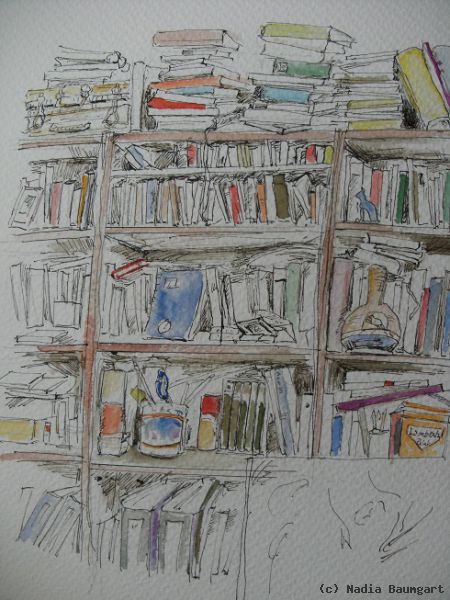
Image resolution: width=450 pixels, height=600 pixels. Identify the location of shelves. (153, 465), (187, 345), (191, 223), (189, 171), (41, 237), (33, 347), (34, 450), (390, 358), (393, 226).